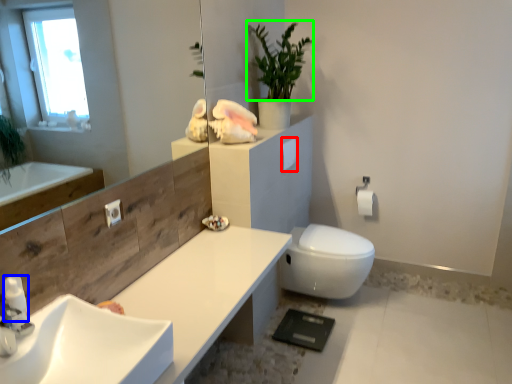
Question: Which object is the closest to the toilet paper (highlighted by a red box)? Choose among these: soap dispenser (highlighted by a blue box) or plant (highlighted by a green box).

Choices:
 (A) soap dispenser
 (B) plant

Answer: (B)